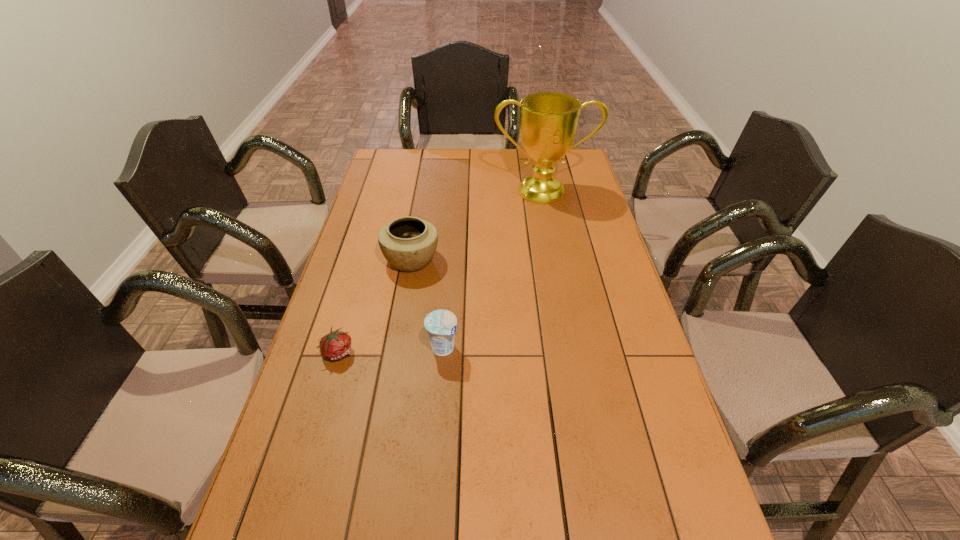
Where is `free space between the second tallest object and the yogurt`? free space between the second tallest object and the yogurt is located at coordinates (427, 303).

I want to click on free space between the tomato and the second shortest object, so click(x=391, y=350).

Locate an element on the screen. The image size is (960, 540). free space between the second shortest object and the award is located at coordinates (492, 269).

The width and height of the screenshot is (960, 540). In order to click on the third closest object to the second farthest object in this screenshot , I will do `click(548, 121)`.

Identify which object is the nearest to the pottery. Please provide its 2D coordinates. Your answer should be formatted as a tuple, i.e. [(x, y)], where the tuple contains the x and y coordinates of a point satisfying the conditions above.

[(441, 325)]